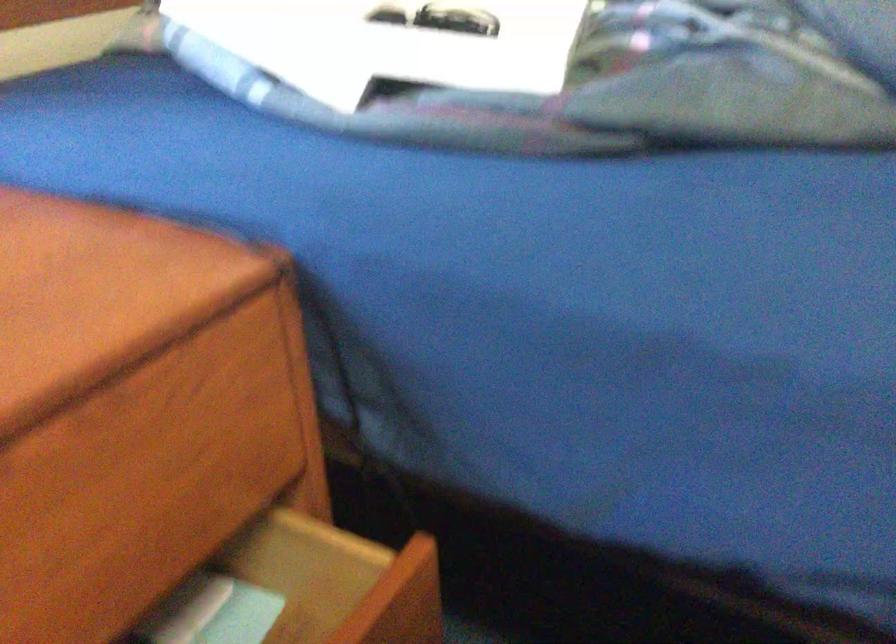
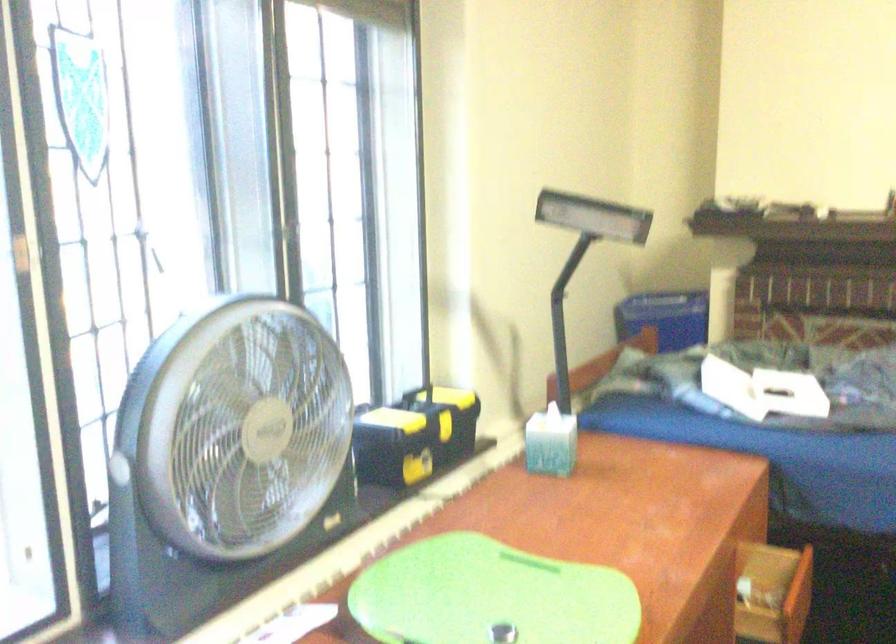
What movement of the cameraman would produce the second image?

The cameraman moved toward left, backward.